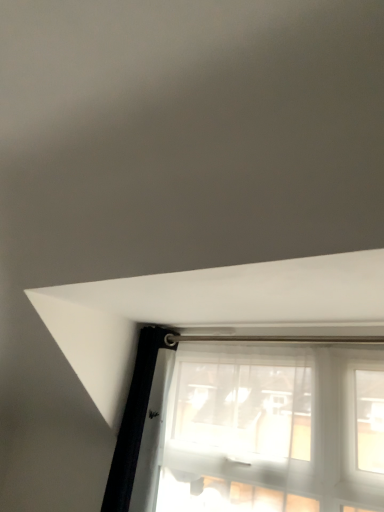
Question: In the image, is metallic silver curtain rod at center positioned in front of or behind translucent fabric window at lower center?

Choices:
 (A) front
 (B) behind

Answer: (B)

Question: Would you say metallic silver curtain rod at center is to the left or to the right of translucent fabric window at lower center in the picture?

Choices:
 (A) left
 (B) right

Answer: (A)

Question: From a real-world perspective, relative to translucent fabric window at lower center, is metallic silver curtain rod at center vertically above or below?

Choices:
 (A) below
 (B) above

Answer: (B)

Question: Is translucent fabric window at lower center wider or thinner than metallic silver curtain rod at center?

Choices:
 (A) wide
 (B) thin

Answer: (B)

Question: Is point (198, 416) closer or farther from the camera than point (238, 334)?

Choices:
 (A) closer
 (B) farther

Answer: (A)

Question: Choose the correct answer: Is translucent fabric window at lower center inside metallic silver curtain rod at center or outside it?

Choices:
 (A) inside
 (B) outside

Answer: (B)

Question: In terms of height, does translucent fabric window at lower center look taller or shorter compared to metallic silver curtain rod at center?

Choices:
 (A) short
 (B) tall

Answer: (B)